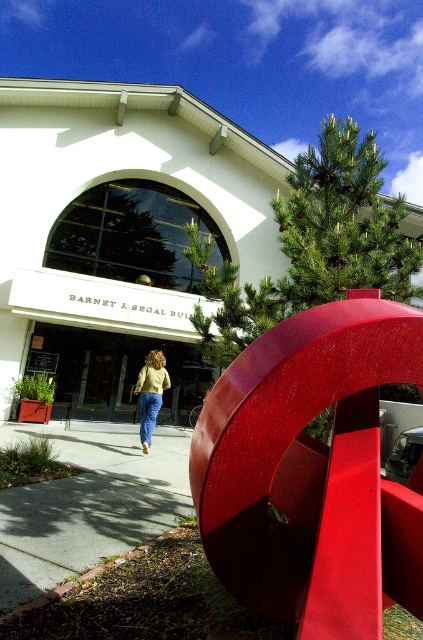
Question: Can you confirm if gray concrete sidewalk at lower left is positioned to the left of matte yellow sweater at center?

Choices:
 (A) no
 (B) yes

Answer: (B)

Question: Among these points, which one is farthest from the camera?

Choices:
 (A) (148, 428)
 (B) (74, 516)

Answer: (A)

Question: Can you confirm if gray concrete sidewalk at lower left is positioned to the left of matte yellow sweater at center?

Choices:
 (A) no
 (B) yes

Answer: (B)

Question: Is gray concrete sidewalk at lower left wider than matte yellow sweater at center?

Choices:
 (A) yes
 (B) no

Answer: (A)

Question: Which of the following is the closest to the observer?

Choices:
 (A) (164, 444)
 (B) (156, 417)

Answer: (B)